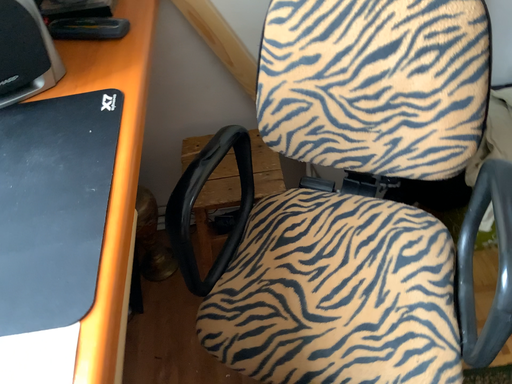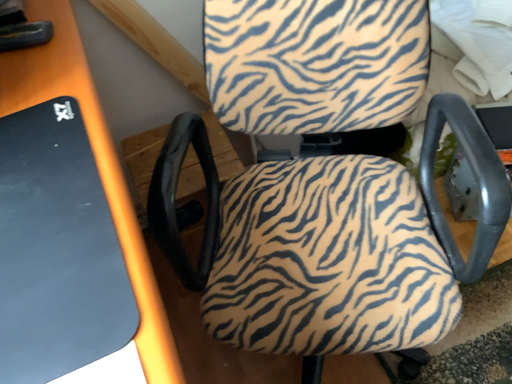
Question: Which way did the camera rotate in the video?

Choices:
 (A) rotated left
 (B) rotated right

Answer: (B)